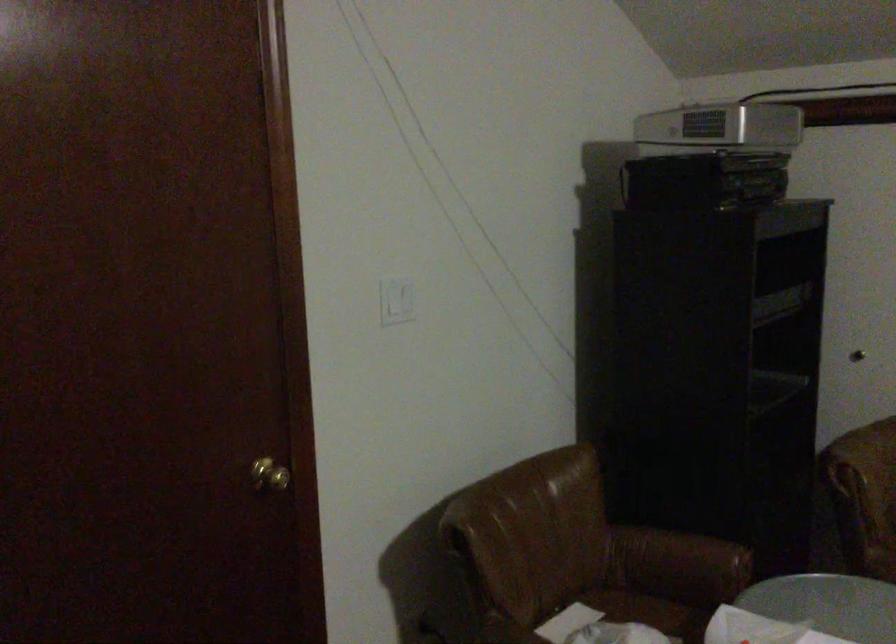
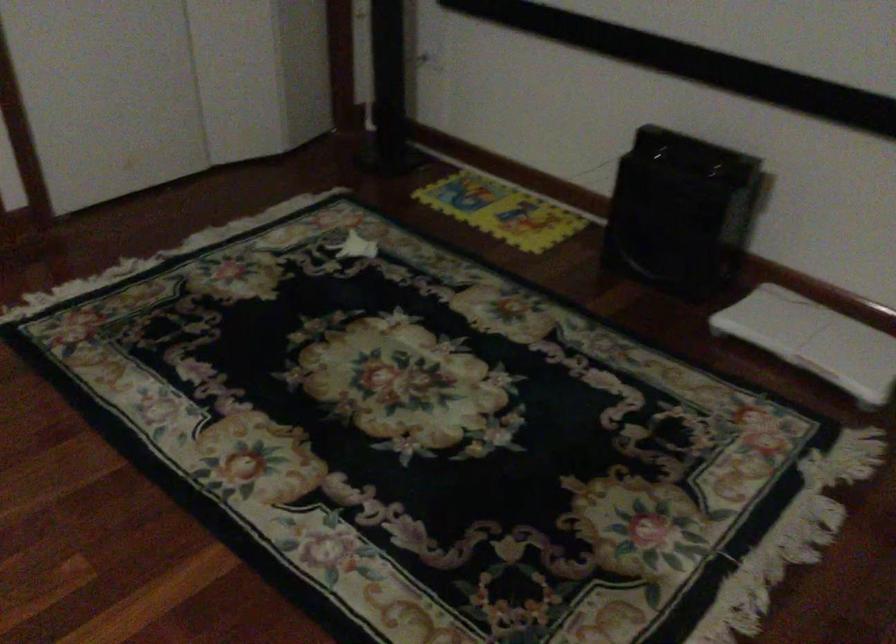
First-person continuous shooting, in which direction is the camera rotating?

The camera's rotation is toward right-down.